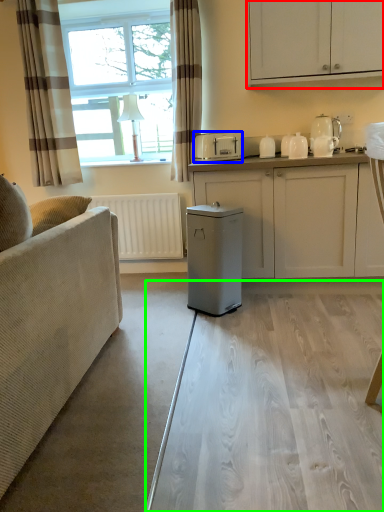
Question: Based on their relative distances, which object is nearer to cabinetry (highlighted by a red box)? Choose from appliance (highlighted by a blue box) and glass table (highlighted by a green box).

Choices:
 (A) appliance
 (B) glass table

Answer: (A)